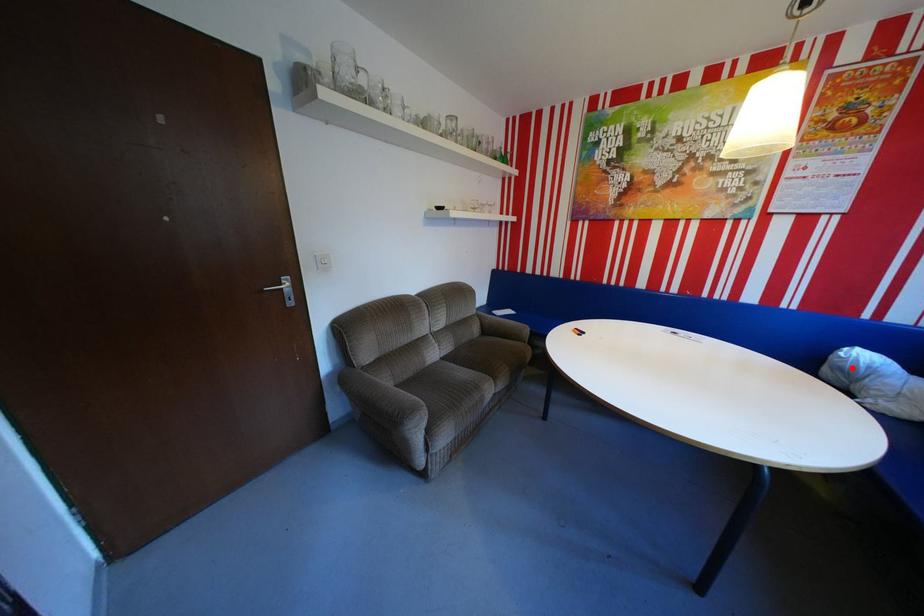
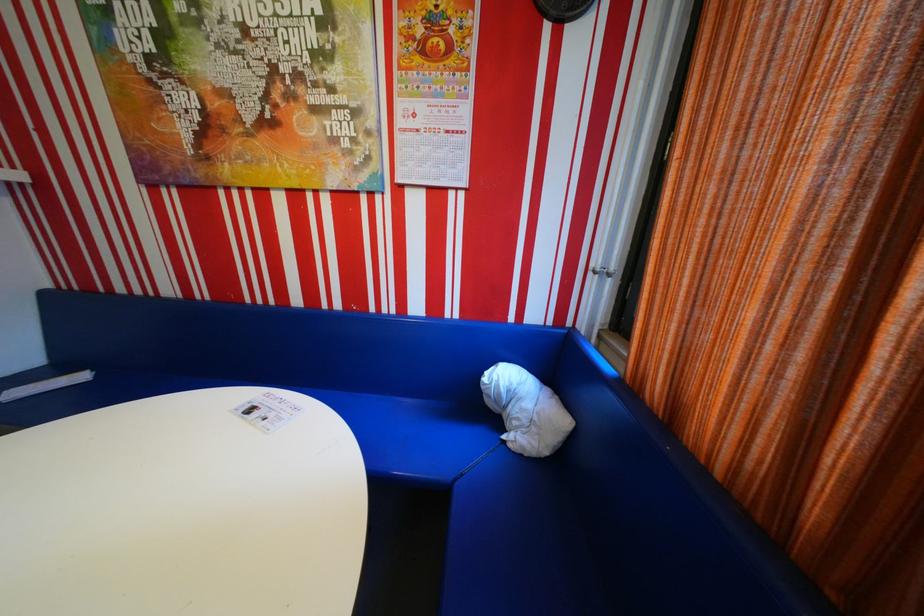
Where in the second image is the point corresponding to the highlighted location from the first image?

(502, 395)